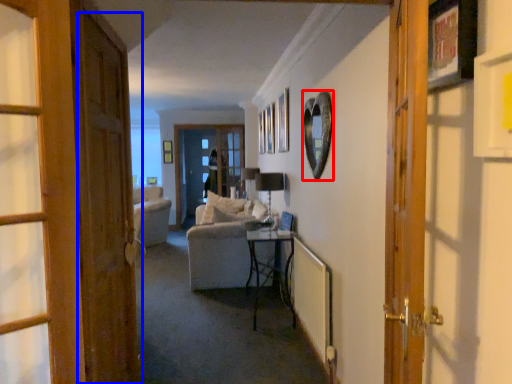
Question: Which of the following is the closest to the observer, picture frame (highlighted by a red box) or door (highlighted by a blue box)?

Choices:
 (A) picture frame
 (B) door

Answer: (B)